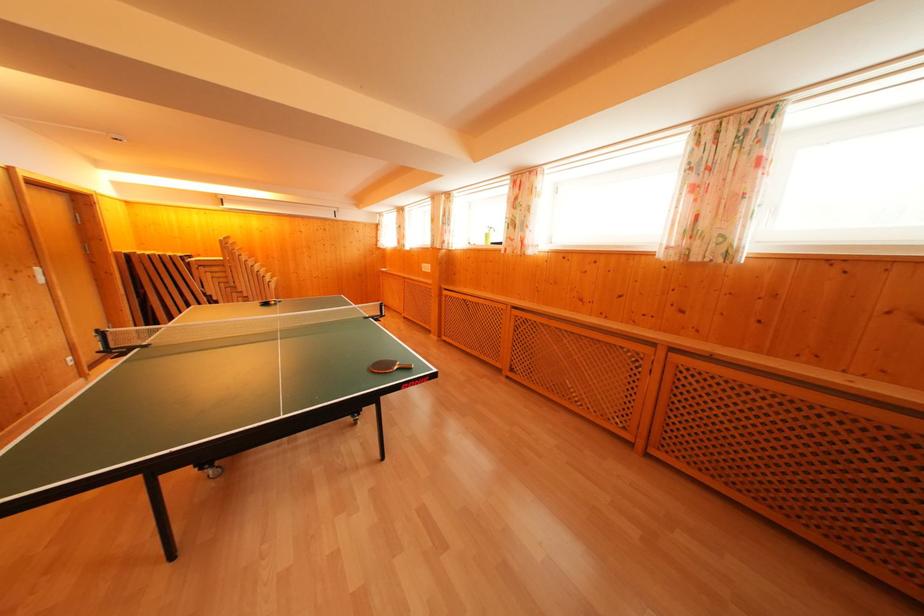
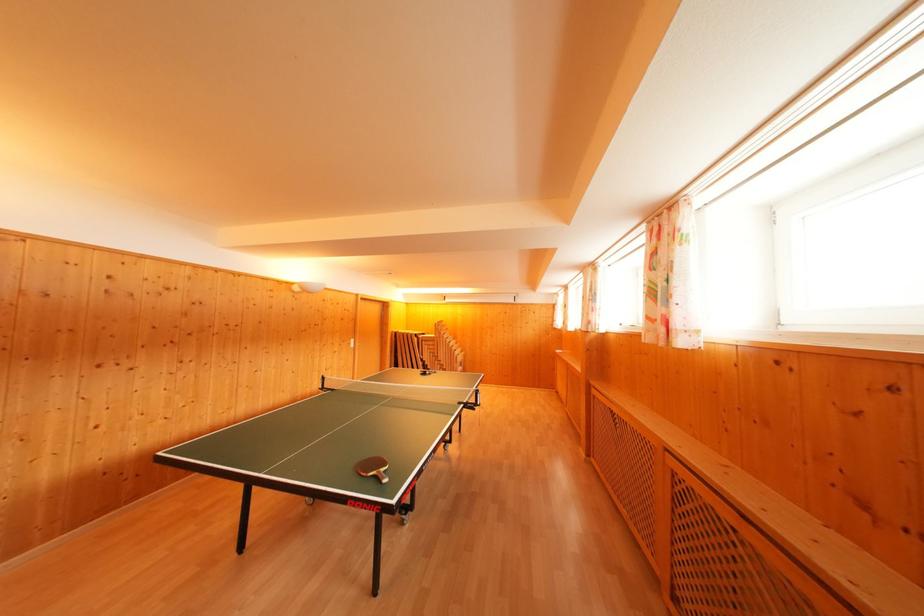
In the second image, find the point that corresponds to [247,293] in the first image.

(445, 362)